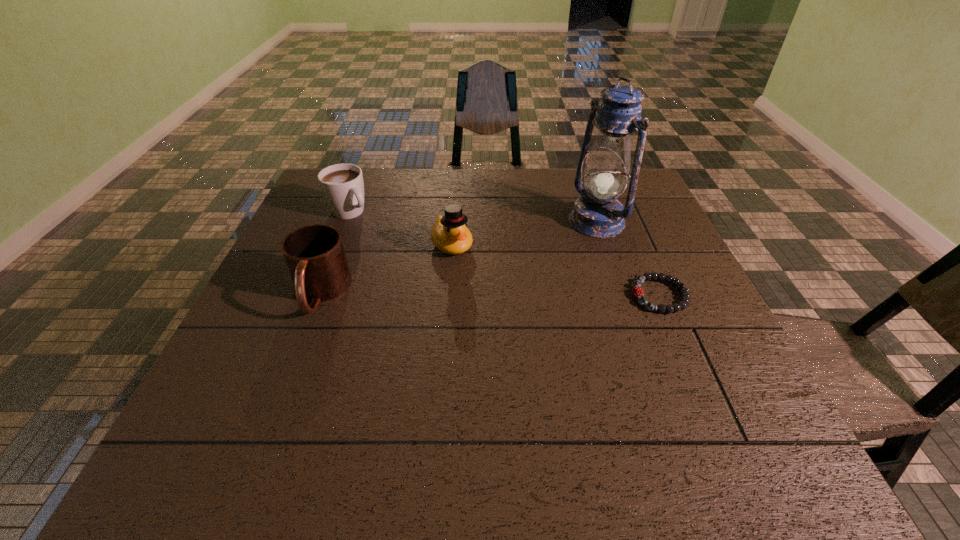
The width and height of the screenshot is (960, 540). What are the coordinates of `bracelet located in the right edge section of the desktop` in the screenshot? It's located at (637, 291).

This screenshot has width=960, height=540. What are the coordinates of `lantern that is at the right edge` in the screenshot? It's located at (597, 213).

Where is `object located in the far left corner section of the desktop`? object located in the far left corner section of the desktop is located at coordinates (342, 185).

Locate an element on the screen. The height and width of the screenshot is (540, 960). object situated at the far right corner is located at coordinates click(597, 213).

Where is `vacant space at the far edge of the desktop`? This screenshot has width=960, height=540. vacant space at the far edge of the desktop is located at coordinates (429, 183).

At what (x,y) coordinates should I click in order to perform the action: click on free spot at the near edge of the desktop. Please return your answer as a coordinate pair (x, y). The image size is (960, 540). Looking at the image, I should click on click(x=471, y=404).

I want to click on blank area at the left edge, so click(268, 294).

At what (x,y) coordinates should I click in order to perform the action: click on blank space at the right edge of the desktop. Please return your answer as a coordinate pair (x, y). This screenshot has width=960, height=540. Looking at the image, I should click on (675, 294).

Where is `vacant area at the near right corner of the desktop`? vacant area at the near right corner of the desktop is located at coordinates (707, 413).

Where is `free space between the mug and the duck`? The height and width of the screenshot is (540, 960). free space between the mug and the duck is located at coordinates (386, 269).